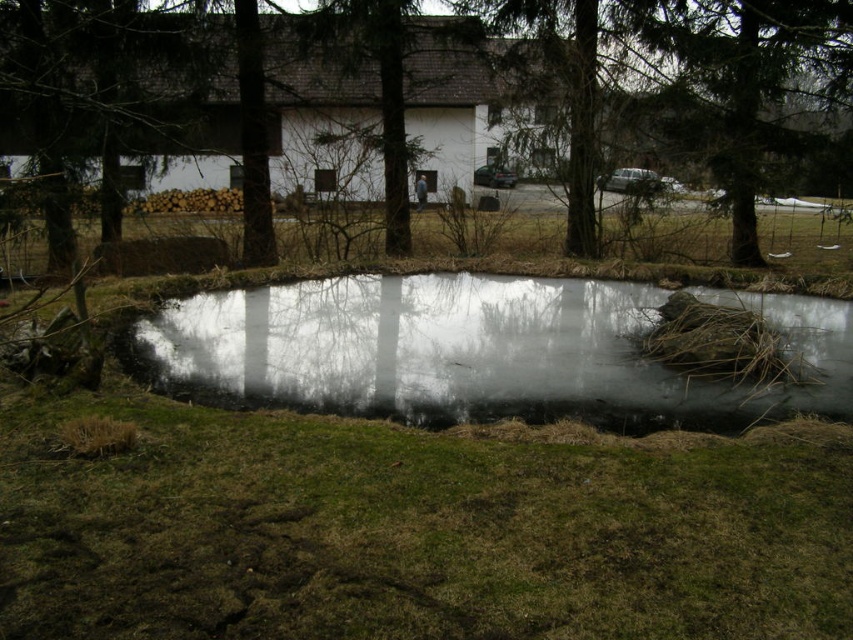
Question: Which point is closer to the camera taking this photo?

Choices:
 (A) (749, 13)
 (B) (589, 292)

Answer: (B)

Question: Does brown textured tree at center have a smaller size compared to transparent ice at center?

Choices:
 (A) yes
 (B) no

Answer: (B)

Question: Does brown textured tree at center appear on the right side of transparent ice at center?

Choices:
 (A) yes
 (B) no

Answer: (B)

Question: Which object appears closest to the camera in this image?

Choices:
 (A) brown textured tree at center
 (B) transparent ice at center

Answer: (A)

Question: Is brown textured tree at center smaller than transparent ice at center?

Choices:
 (A) yes
 (B) no

Answer: (B)